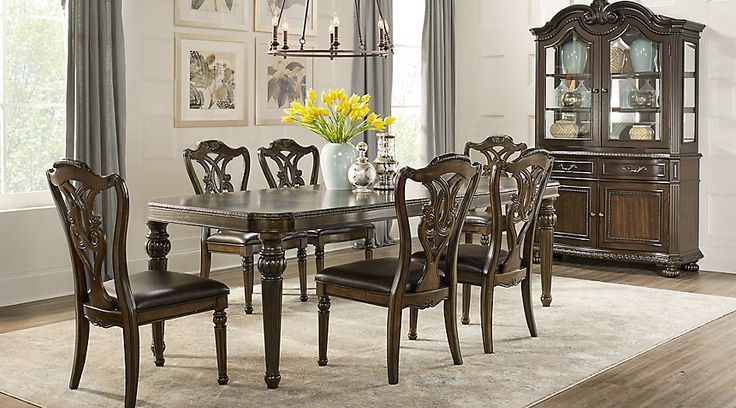
Locate an element on the screen. chair cushion is located at coordinates (169, 299), (233, 234), (321, 229), (369, 273), (464, 252), (473, 218).